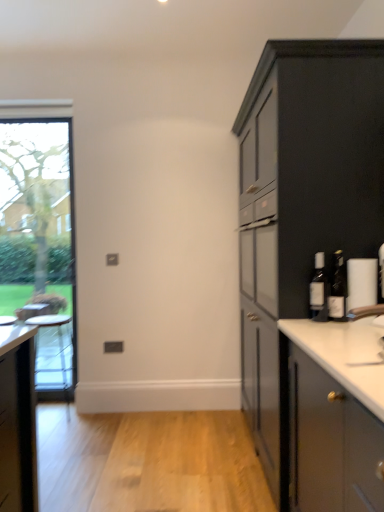
Question: In terms of height, does translucent glass bottle at right, which is the first bottle from left to right, look taller or shorter compared to matte gray cabinet at right?

Choices:
 (A) tall
 (B) short

Answer: (B)

Question: From a real-world perspective, is translucent glass bottle at right, the second bottle viewed from the right, positioned above or below matte gray cabinet at right?

Choices:
 (A) below
 (B) above

Answer: (B)

Question: Which of these objects is positioned farthest from the white glossy table at left?

Choices:
 (A) matte gray cabinet at right
 (B) translucent glass bottle at right, the second bottle viewed from the right
 (C) matte glass bottle at right, the second bottle when ordered from left to right
 (D) clear glass window at left

Answer: (C)

Question: Which of these objects is positioned farthest from the clear glass window at left?

Choices:
 (A) matte gray cabinet at right
 (B) matte glass bottle at right, the second bottle when ordered from left to right
 (C) white glossy table at left
 (D) translucent glass bottle at right, which is the first bottle from left to right

Answer: (B)